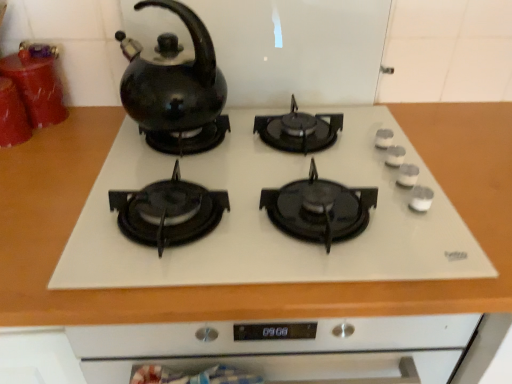
Question: Would you say shiny red glass cups at left, the second kitchen appliance positioned from the front, is part of black glossy kettle at upper left's contents?

Choices:
 (A) yes
 (B) no

Answer: (B)

Question: From the image's perspective, is black glossy kettle at upper left under shiny red glass cups at left, which is counted as the 1th kitchen appliance, starting from the back?

Choices:
 (A) yes
 (B) no

Answer: (A)

Question: Is black glossy kettle at upper left positioned in front of shiny red glass cups at left, the second kitchen appliance positioned from the front?

Choices:
 (A) no
 (B) yes

Answer: (B)

Question: Does black glossy kettle at upper left have a greater width compared to shiny red glass cups at left, which is counted as the 1th kitchen appliance, starting from the back?

Choices:
 (A) no
 (B) yes

Answer: (B)

Question: From the image's perspective, is black glossy kettle at upper left on shiny red glass cups at left, which is counted as the 1th kitchen appliance, starting from the back?

Choices:
 (A) no
 (B) yes

Answer: (A)

Question: Visually, is matte red canister at left, which appears as the 1th kitchen appliance when viewed from the front, positioned to the left or to the right of shiny red glass cups at left, the second kitchen appliance positioned from the front?

Choices:
 (A) left
 (B) right

Answer: (A)

Question: Is matte red canister at left, which appears as the 1th kitchen appliance when viewed from the front, in front of or behind shiny red glass cups at left, which is counted as the 1th kitchen appliance, starting from the back, in the image?

Choices:
 (A) front
 (B) behind

Answer: (A)

Question: Does point (20, 114) appear closer or farther from the camera than point (46, 114)?

Choices:
 (A) farther
 (B) closer

Answer: (B)

Question: In terms of width, does matte red canister at left, which appears as the 1th kitchen appliance when viewed from the front, look wider or thinner when compared to shiny red glass cups at left, which is counted as the 1th kitchen appliance, starting from the back?

Choices:
 (A) wide
 (B) thin

Answer: (B)

Question: Is black glossy kettle at upper left in front of or behind shiny red glass cups at left, which is counted as the 1th kitchen appliance, starting from the back, in the image?

Choices:
 (A) behind
 (B) front

Answer: (B)

Question: Does point (165, 74) appear closer or farther from the camera than point (44, 92)?

Choices:
 (A) farther
 (B) closer

Answer: (B)

Question: Would you say black glossy kettle at upper left is to the left or to the right of shiny red glass cups at left, which is counted as the 1th kitchen appliance, starting from the back, in the picture?

Choices:
 (A) left
 (B) right

Answer: (B)

Question: From the image's perspective, is black glossy kettle at upper left above or below shiny red glass cups at left, which is counted as the 1th kitchen appliance, starting from the back?

Choices:
 (A) above
 (B) below

Answer: (B)

Question: Considering the positions of white glossy gas stove at center and black glossy kettle at upper left in the image, is white glossy gas stove at center taller or shorter than black glossy kettle at upper left?

Choices:
 (A) tall
 (B) short

Answer: (B)

Question: Is white glossy gas stove at center wider or thinner than black glossy kettle at upper left?

Choices:
 (A) wide
 (B) thin

Answer: (A)